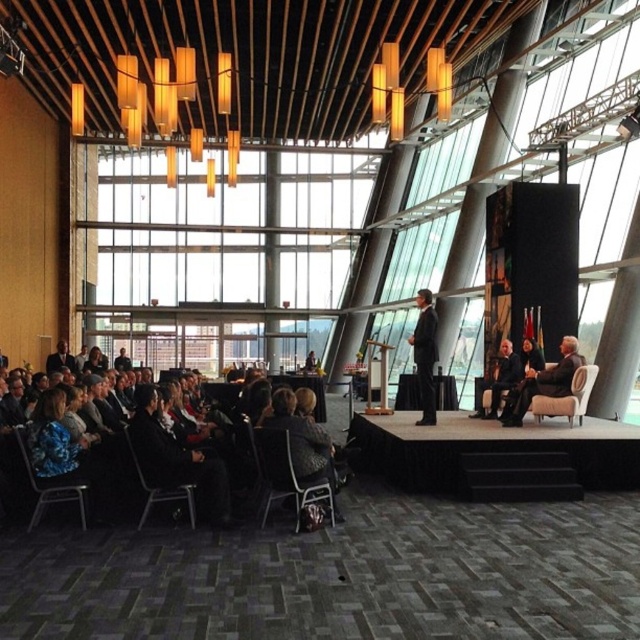
Between point (580, 355) and point (436, 353), which one is positioned in front?

Point (580, 355) is in front.

Which is behind, point (538, 388) or point (422, 419)?

The point (422, 419) is behind.

I want to click on light beige leather chair at right, so click(544, 381).

Does black fabric chair at lower center appear on the right side of dark suit at center?

Incorrect, black fabric chair at lower center is not on the right side of dark suit at center.

Does black fabric chair at lower center have a lesser height compared to dark suit at center?

Indeed, black fabric chair at lower center has a lesser height compared to dark suit at center.

Is point (253, 442) positioned in front of point (417, 349)?

Yes, point (253, 442) is closer to viewer.

Find the location of a particular element. The width and height of the screenshot is (640, 640). black fabric chair at lower center is located at coordinates (289, 474).

Which is behind, point (241, 460) or point (524, 385)?

Point (524, 385)

Between dark gray fabric chairs at lower left and light beige leather chair at right, which one has less height?

light beige leather chair at right is shorter.

Who is more distant from viewer, (74,424) or (502,420)?

The point (502,420) is behind.

Image resolution: width=640 pixels, height=640 pixels. In order to click on dark gray fabric chairs at lower left in this screenshot , I will do `click(118, 452)`.